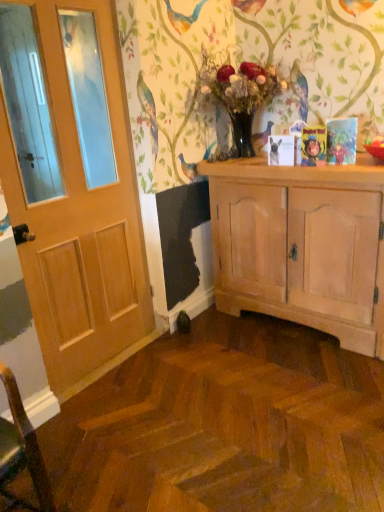
This screenshot has height=512, width=384. Find the location of `vacant space in front of matte white dog at center`. vacant space in front of matte white dog at center is located at coordinates (296, 170).